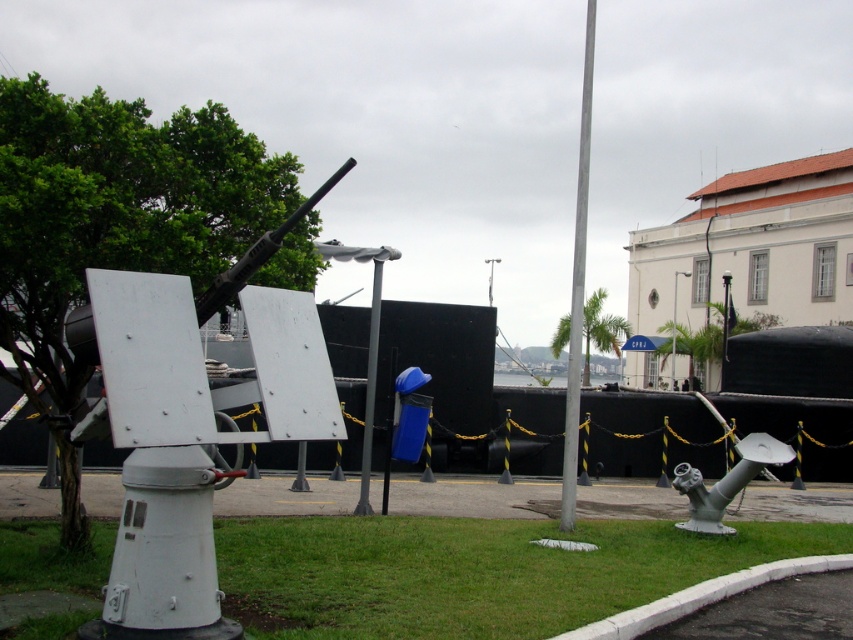
Is silver metallic cannon at lower right to the left of metallic pole at center from the viewer's perspective?

In fact, silver metallic cannon at lower right is to the right of metallic pole at center.

Is silver metallic cannon at lower right shorter than metallic pole at center?

Yes.

Image resolution: width=853 pixels, height=640 pixels. Describe the element at coordinates (726, 481) in the screenshot. I see `silver metallic cannon at lower right` at that location.

Locate an element on the screen. Image resolution: width=853 pixels, height=640 pixels. silver metallic cannon at lower right is located at coordinates (726, 481).

Who is shorter, white matte cannon at center or silver metallic cannon at lower right?

With less height is silver metallic cannon at lower right.

Does point (166, 604) come in front of point (784, 461)?

Yes, it is.

You are a GUI agent. You are given a task and a screenshot of the screen. Output one action in this format:
    pyautogui.click(x=<x>, y=<y>)
    Task: Click on the white matte cannon at center
    
    Given the screenshot: What is the action you would take?
    pyautogui.click(x=164, y=552)

Where is `green grass at lower center`? Image resolution: width=853 pixels, height=640 pixels. green grass at lower center is located at coordinates (473, 572).

This screenshot has height=640, width=853. I want to click on green grass at lower center, so click(x=473, y=572).

The height and width of the screenshot is (640, 853). I want to click on green grass at lower center, so click(473, 572).